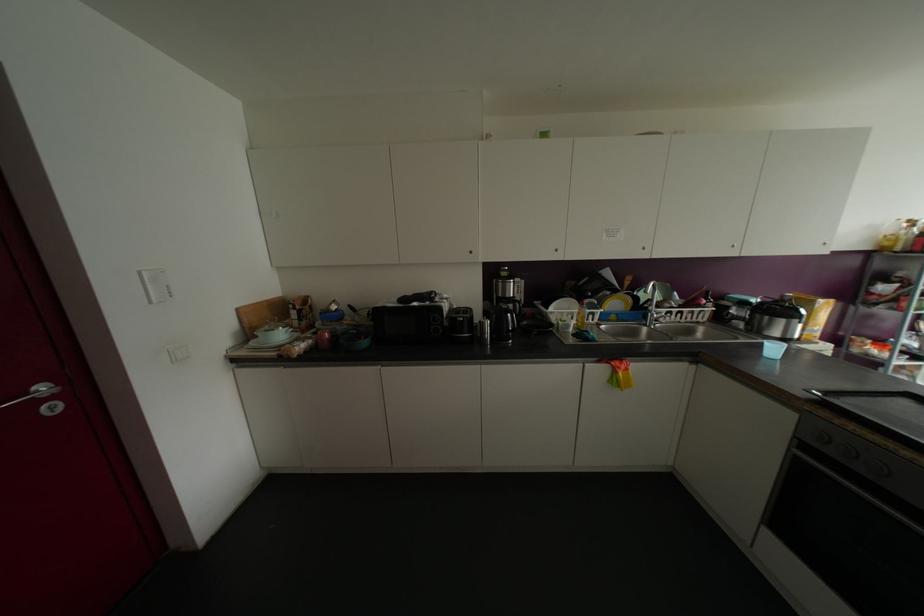
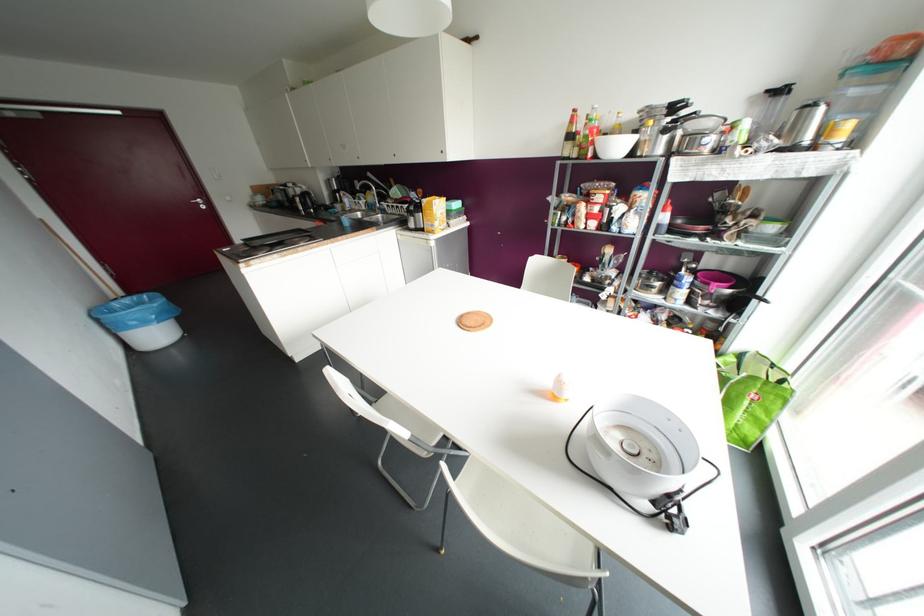
Where in the second image is the point corresponding to point 53,408 from the first image?

(202, 207)